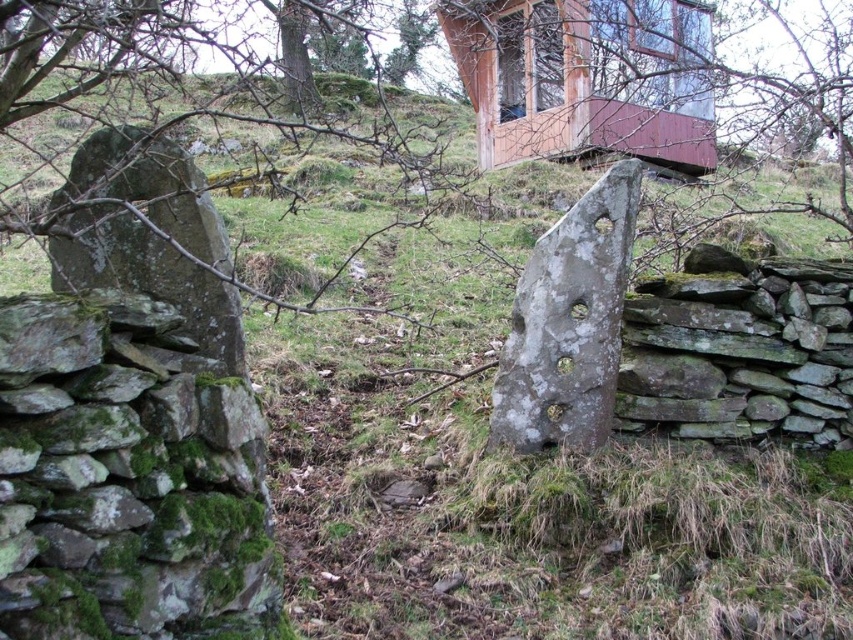
You are standing at the base of the stone wall and want to see the wooden hut at upper center. Can you see it over the gray stone at center?

The wooden hut at upper center is much taller than the gray stone at center, so yes, you can see it over the gray stone at center.

You are standing at the base of the hill and want to walk towards the wooden hut at upper center and the gray stone at center. Which object will you encounter first as you ascend the hill?

You will encounter the wooden hut at upper center first because it is closer to you than the gray stone at center, which is further away.